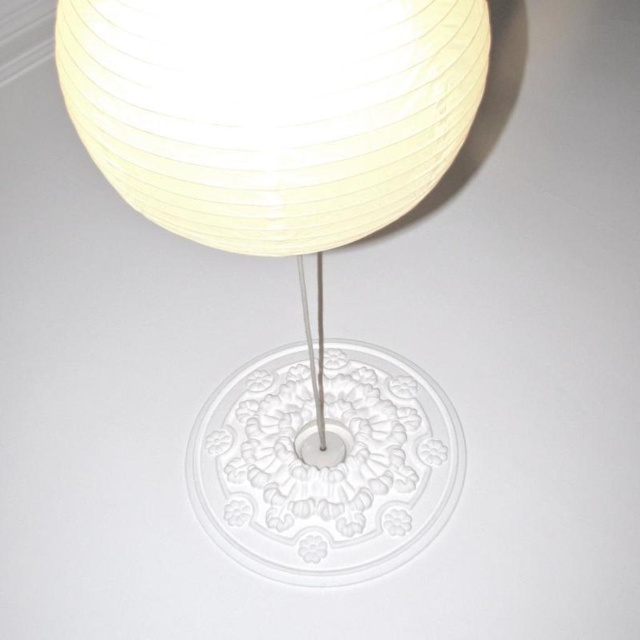
Does white paper lampshade at center have a smaller size compared to white paper lampshade at upper center?

Actually, white paper lampshade at center might be larger than white paper lampshade at upper center.

Which is above, white paper lampshade at center or white paper lampshade at upper center?

Positioned higher is white paper lampshade at upper center.

Is point (385, 54) behind point (257, 252)?

No, it is not.

The width and height of the screenshot is (640, 640). What are the coordinates of `white paper lampshade at center` in the screenshot? It's located at (291, 240).